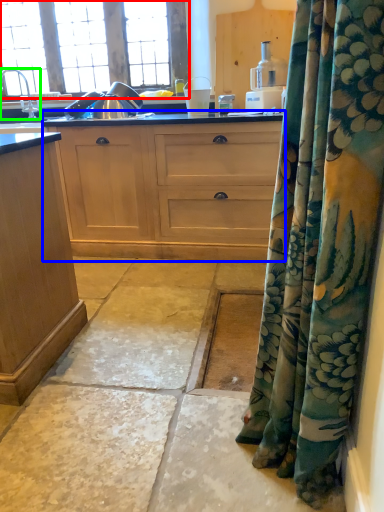
Question: Estimate the real-world distances between objects in this image. Which object is closer to window (highlighted by a red box), cabinetry (highlighted by a blue box) or faucet (highlighted by a green box)?

Choices:
 (A) cabinetry
 (B) faucet

Answer: (B)